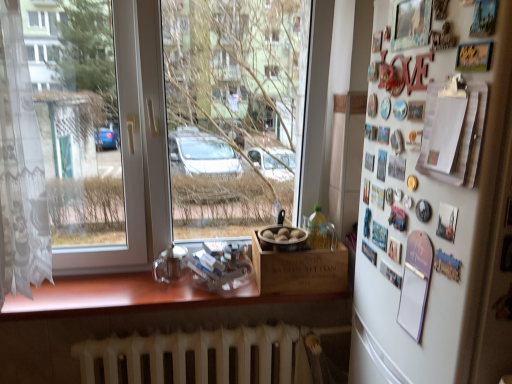
Question: Is the depth of white metallic radiator at lower center less than that of transparent glass window at center?

Choices:
 (A) no
 (B) yes

Answer: (A)

Question: Can you confirm if white metallic radiator at lower center is wider than transparent glass window at center?

Choices:
 (A) no
 (B) yes

Answer: (A)

Question: From a real-world perspective, is white metallic radiator at lower center positioned under transparent glass window at center based on gravity?

Choices:
 (A) no
 (B) yes

Answer: (B)

Question: Does white metallic radiator at lower center have a lesser width compared to transparent glass window at center?

Choices:
 (A) no
 (B) yes

Answer: (B)

Question: Is white metallic radiator at lower center outside transparent glass window at center?

Choices:
 (A) yes
 (B) no

Answer: (A)

Question: Is wooden box at center inside or outside of white matte refrigerator at right?

Choices:
 (A) inside
 (B) outside

Answer: (B)

Question: From the image's perspective, is wooden box at center located above or below white matte refrigerator at right?

Choices:
 (A) above
 (B) below

Answer: (B)

Question: Considering the positions of point 280,289 and point 454,61, is point 280,289 closer or farther from the camera than point 454,61?

Choices:
 (A) farther
 (B) closer

Answer: (A)

Question: From a real-world perspective, relative to white matte refrigerator at right, is wooden box at center vertically above or below?

Choices:
 (A) below
 (B) above

Answer: (A)

Question: From a real-world perspective, is white matte refrigerator at right above or below white metallic radiator at lower center?

Choices:
 (A) above
 (B) below

Answer: (A)

Question: From the image's perspective, relative to white metallic radiator at lower center, is white matte refrigerator at right above or below?

Choices:
 (A) above
 (B) below

Answer: (A)

Question: In terms of height, does white matte refrigerator at right look taller or shorter compared to white metallic radiator at lower center?

Choices:
 (A) tall
 (B) short

Answer: (A)

Question: Looking at the image, does white matte refrigerator at right seem bigger or smaller compared to white metallic radiator at lower center?

Choices:
 (A) big
 (B) small

Answer: (A)

Question: Is wooden box at center to the left or to the right of wooden at lower center in the image?

Choices:
 (A) left
 (B) right

Answer: (B)

Question: Considering the positions of wooden box at center and wooden at lower center in the image, is wooden box at center bigger or smaller than wooden at lower center?

Choices:
 (A) small
 (B) big

Answer: (A)